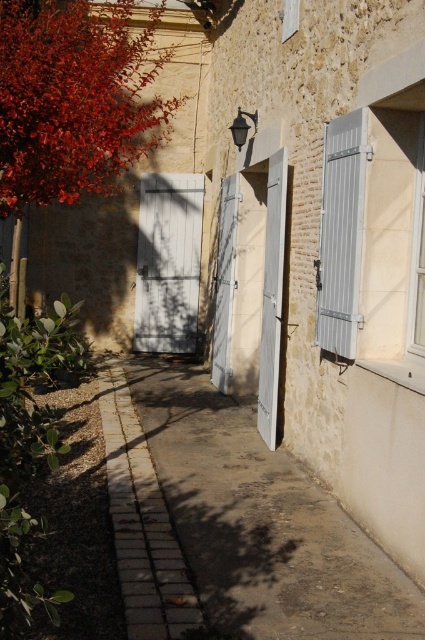
You are navigating a narrow alleyway between two stone buildings. You see two points marked on the ground. One is at point (159, 275) and the other at point (328, 218). Which point is closer to you as you stand at the entrance of the alley?

Point (328, 218) is closer to you because point (159, 275) is behind it.

You are a delivery person with a cart that is 2 feet wide. You need to navigate through the alleyway and pass between the white matte door at center and the white painted wood door at center. Can your cart fit through the space between them?

The distance between the white matte door at center and the white painted wood door at center is 6.24 feet. Since your cart is only 2 feet wide, it can easily fit through the space between them.

You are a delivery person trying to enter the alleyway. You see a white matte door at center and a metallic gray shutter at right. Which object is closer to you as you approach the alleyway entrance?

The white matte door at center is closer to you because the metallic gray shutter at right is behind it.